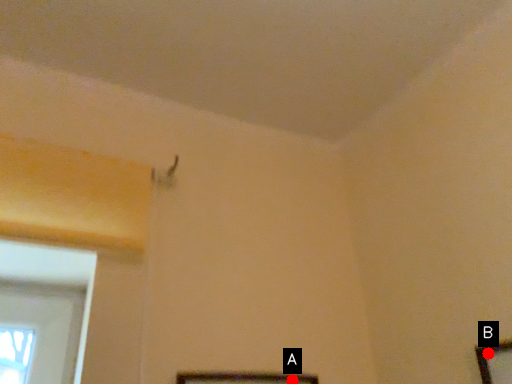
Question: Two points are circled on the image, labeled by A and B beside each circle. Which point is farther to the camera?

Choices:
 (A) A is further
 (B) B is further

Answer: (A)